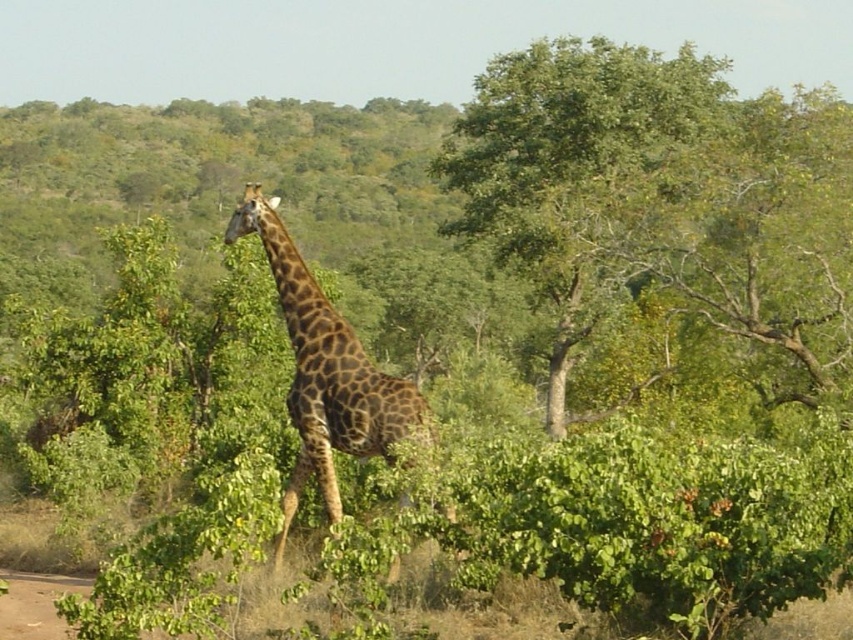
Question: Is green leafy tree at upper right closer to the viewer compared to spotted fur giraffe at center?

Choices:
 (A) yes
 (B) no

Answer: (B)

Question: Observing the image, what is the correct spatial positioning of green leafy tree at upper right in reference to spotted fur giraffe at center?

Choices:
 (A) below
 (B) above

Answer: (B)

Question: Which point is farther to the camera?

Choices:
 (A) spotted fur giraffe at center
 (B) green leafy tree at upper right

Answer: (B)

Question: Which point is farther from the camera taking this photo?

Choices:
 (A) (757, 145)
 (B) (274, 554)

Answer: (A)

Question: In this image, where is green leafy tree at upper right located relative to spotted fur giraffe at center?

Choices:
 (A) right
 (B) left

Answer: (A)